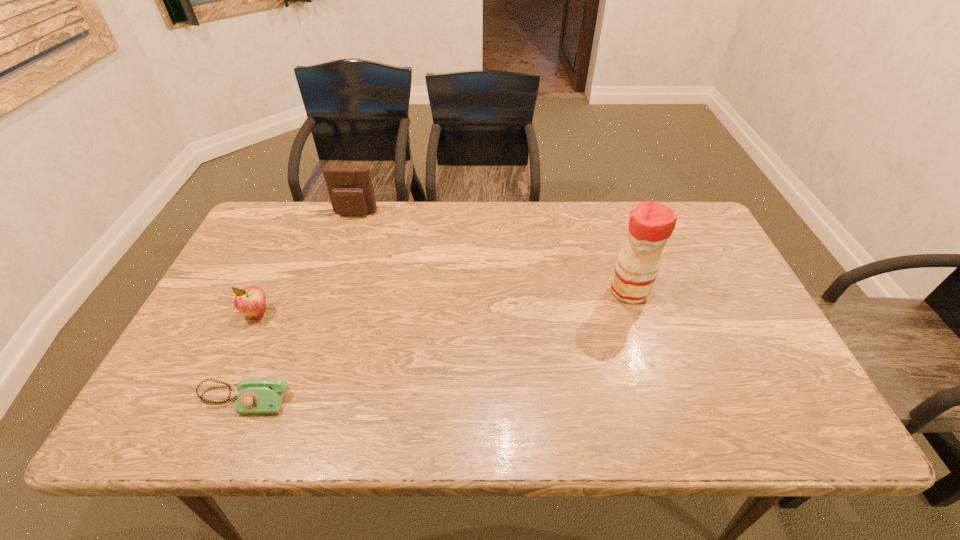
Identify the location of free point between the apple and the third shortest object. (306, 264).

Point out which object is positioned as the second nearest to the pouch. Please provide its 2D coordinates. Your answer should be formatted as a tuple, i.e. [(x, y)], where the tuple contains the x and y coordinates of a point satisfying the conditions above.

[(256, 396)]

Identify the location of the second closest object relative to the tallest object. (256, 396).